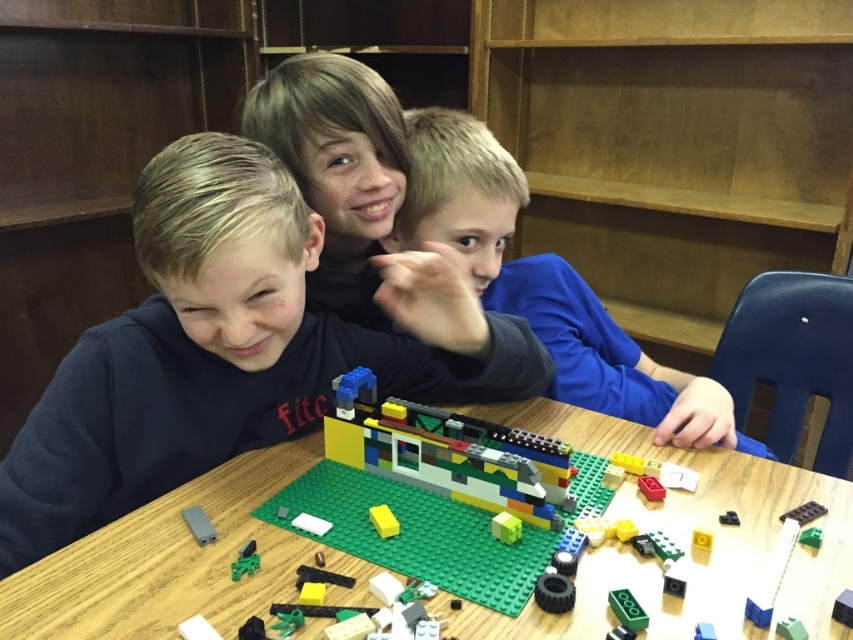
You are standing at the origin point in the scene. The yellow matte brick at center is located at coordinates point (x=383, y=520). If you move 0.1 units to the right along the x axis, will you be closer to or farther from the yellow matte brick at center?

Moving 0.1 units to the right along the x axis from the origin point would increase your x coordinate by 0.1. Since the yellow matte brick at center is located at x 0.814, moving right would bring you closer to its x coordinate of 0.814. Therefore you would be closer to the yellow matte brick at center.

You are a child trying to place a new LEGO piece between the yellow matte brick at center and the black plastic car at center. Can you fit it there?

The yellow matte brick at center might be wider than the black plastic car at center, so there may not be enough space to fit a new LEGO piece between them.

You are a parent trying to organize your childen room. You have a green plastic table at center and a smooth plastic lego set at center. Which object takes up more space in the room?

The smooth plastic lego set at center takes up more space than the green plastic table at center because it is larger in size.